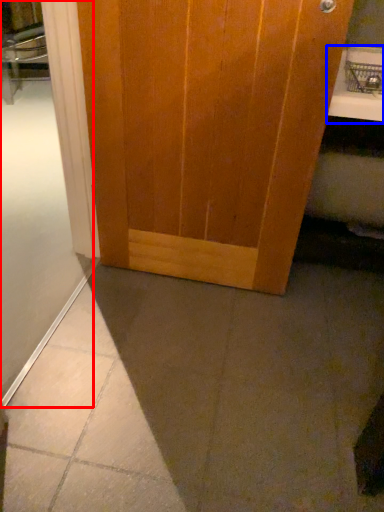
Question: Which object is closer to the camera taking this photo, shower door (highlighted by a red box) or counter top (highlighted by a blue box)?

Choices:
 (A) shower door
 (B) counter top

Answer: (A)